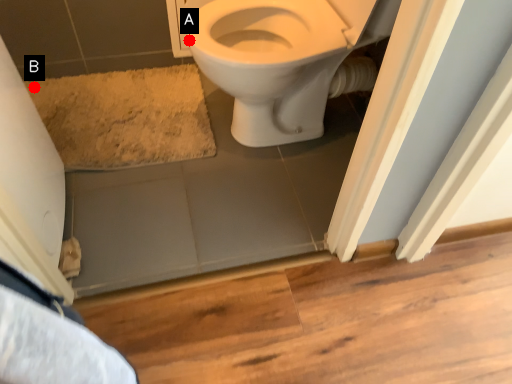
Question: Two points are circled on the image, labeled by A and B beside each circle. Which point appears farthest from the camera in this image?

Choices:
 (A) A is further
 (B) B is further

Answer: (B)